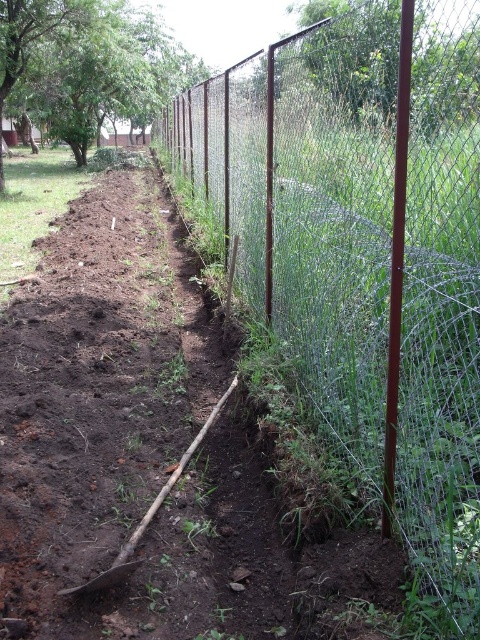
Question: Does wire mesh fence at center appear on the right side of brown soil at center?

Choices:
 (A) yes
 (B) no

Answer: (A)

Question: Which of the following is the closest to the observer?

Choices:
 (A) brown soil at center
 (B) wire mesh fence at center

Answer: (B)

Question: Which point appears farthest from the camera in this image?

Choices:
 (A) (376, 124)
 (B) (189, 260)

Answer: (B)

Question: Can you confirm if wire mesh fence at center is positioned above brown soil at center?

Choices:
 (A) no
 (B) yes

Answer: (B)

Question: Does wire mesh fence at center have a lesser width compared to brown soil at center?

Choices:
 (A) no
 (B) yes

Answer: (B)